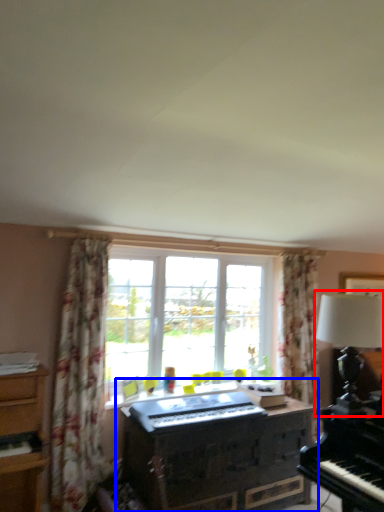
Question: Which point is further to the camera, table lamp (highlighted by a red box) or dresser (highlighted by a blue box)?

Choices:
 (A) table lamp
 (B) dresser

Answer: (B)